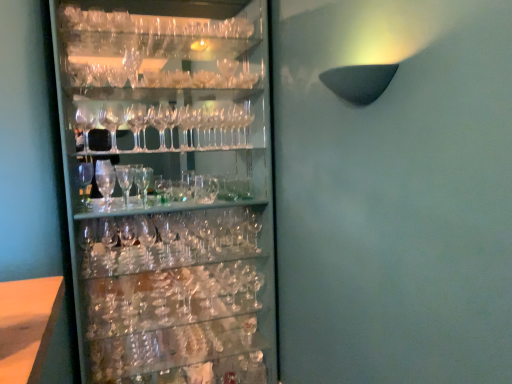
Question: From the image's perspective, is clear glass wine glass at upper center located beneath clear glass wine glasses at left?

Choices:
 (A) no
 (B) yes

Answer: (A)

Question: Is clear glass wine glass at upper center positioned in front of clear glass wine glasses at left?

Choices:
 (A) no
 (B) yes

Answer: (A)

Question: Can you confirm if clear glass wine glass at upper center is wider than clear glass wine glasses at left?

Choices:
 (A) yes
 (B) no

Answer: (B)

Question: Can you confirm if clear glass wine glass at upper center is shorter than clear glass wine glasses at left?

Choices:
 (A) no
 (B) yes

Answer: (B)

Question: Can you confirm if clear glass wine glass at upper center is taller than clear glass wine glasses at left?

Choices:
 (A) no
 (B) yes

Answer: (A)

Question: From a real-world perspective, is clear glass wine glass at upper center on clear glass wine glasses at left?

Choices:
 (A) no
 (B) yes

Answer: (B)

Question: Is clear glass wine glasses at left at the left side of clear glass beer glass at center?

Choices:
 (A) yes
 (B) no

Answer: (B)

Question: Considering the relative sizes of clear glass wine glasses at left and clear glass beer glass at center in the image provided, is clear glass wine glasses at left wider than clear glass beer glass at center?

Choices:
 (A) no
 (B) yes

Answer: (B)

Question: From the image's perspective, is clear glass wine glasses at left above clear glass beer glass at center?

Choices:
 (A) yes
 (B) no

Answer: (B)

Question: From a real-world perspective, is clear glass wine glasses at left physically above clear glass beer glass at center?

Choices:
 (A) no
 (B) yes

Answer: (A)

Question: Does clear glass wine glasses at left come behind clear glass beer glass at center?

Choices:
 (A) yes
 (B) no

Answer: (B)

Question: Is clear glass wine glasses at left at the right side of clear glass beer glass at center?

Choices:
 (A) yes
 (B) no

Answer: (A)

Question: Can you confirm if clear glass beer glass at center is thinner than clear glass wine glasses at left?

Choices:
 (A) yes
 (B) no

Answer: (A)